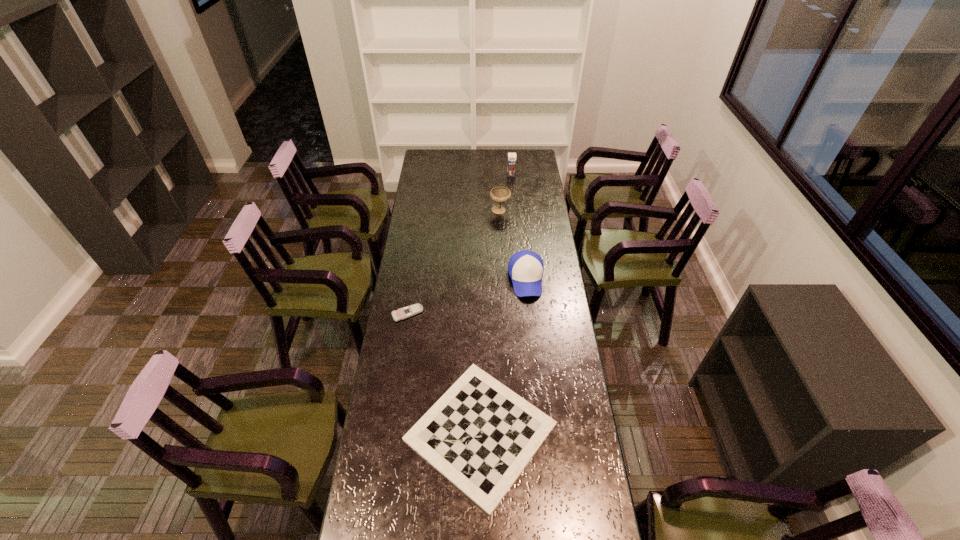
The width and height of the screenshot is (960, 540). I want to click on remote control that is positioned at the left edge, so click(403, 313).

Where is `checkerboard present at the left edge`? checkerboard present at the left edge is located at coordinates (480, 435).

This screenshot has height=540, width=960. I want to click on baseball cap that is at the right edge, so click(525, 267).

The height and width of the screenshot is (540, 960). What are the coordinates of `checkerboard that is at the right edge` in the screenshot? It's located at (480, 435).

Find the location of a particular element. vacant space at the far edge of the desktop is located at coordinates (477, 159).

Locate an element on the screen. The height and width of the screenshot is (540, 960). free point at the left edge is located at coordinates (418, 402).

Where is `free space at the right edge`? The width and height of the screenshot is (960, 540). free space at the right edge is located at coordinates (x=574, y=383).

You are a GUI agent. You are given a task and a screenshot of the screen. Output one action in this format:
    pyautogui.click(x=<x>, y=<y>)
    Task: Click on the free region at the far left corner
    
    Given the screenshot: What is the action you would take?
    pyautogui.click(x=442, y=164)

Identify the location of free space at the far right corner of the desktop. The image size is (960, 540). (524, 167).

Find the location of a particular element. This screenshot has width=960, height=540. empty location between the chalice and the nearest object is located at coordinates (491, 321).